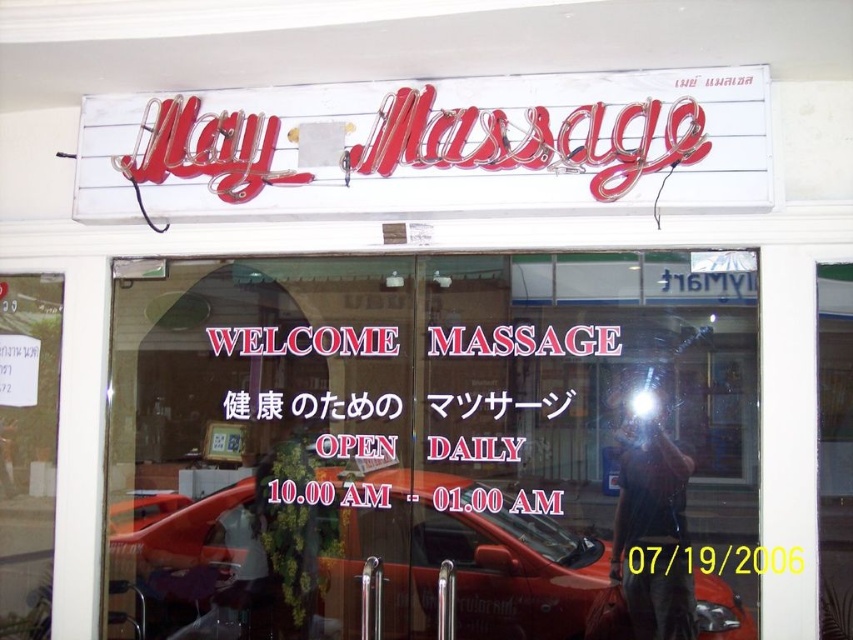
Between neon red sign at upper center and shiny red car at center, which one has less height?

neon red sign at upper center is shorter.

Is point (370, 145) positioned after point (412, 488)?

No.

Locate an element on the screen. This screenshot has height=640, width=853. neon red sign at upper center is located at coordinates pos(438,147).

Does transparent glass door at center have a lesser height compared to neon red sign at upper center?

In fact, transparent glass door at center may be taller than neon red sign at upper center.

Between point (218, 332) and point (711, 124), which one is positioned behind?

The point (218, 332) is behind.

Who is more forward, (616, 614) or (407, 163)?

Positioned in front is point (616, 614).

Identify the location of transparent glass door at center. This screenshot has width=853, height=640. (434, 448).

Consider the image. Between transparent glass door at center and shiny red car at center, which one has more height?

With more height is transparent glass door at center.

Is transparent glass door at center to the right of shiny red car at center from the viewer's perspective?

Yes, transparent glass door at center is to the right of shiny red car at center.

This screenshot has height=640, width=853. I want to click on transparent glass door at center, so click(434, 448).

Image resolution: width=853 pixels, height=640 pixels. What are the coordinates of `transparent glass door at center` in the screenshot? It's located at (434, 448).